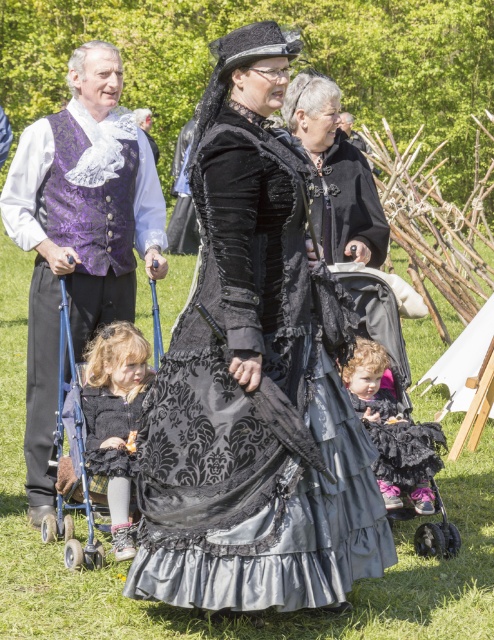
You are a costume designer preparing for a play. You have two items from the image to choose from for a character who needs a wide garment to emphasize their status. Which item from the velvet black dress at center and the fluffy black coat at lower left would you select?

The velvet black dress at center is wider than the fluffy black coat at lower left, so you should choose the velvet black dress at center to emphasize the character status.

You are standing at the point with coordinates point (161, 204) and want to walk towards the point with coordinates point (162, 445). Which direction should you move in?

You should move forward because point (162, 445) is in front of point (161, 204).